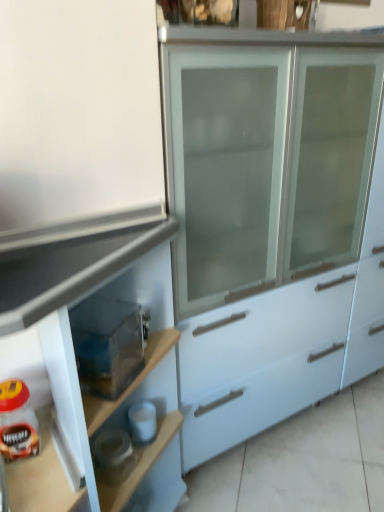
Question: Would you consider matte white cabinet at center to be distant from matte glass jar of coffee at lower left?

Choices:
 (A) yes
 (B) no

Answer: (B)

Question: Is matte white cabinet at center oriented away from matte glass jar of coffee at lower left?

Choices:
 (A) yes
 (B) no

Answer: (A)

Question: Can you confirm if matte white cabinet at center is bigger than matte glass jar of coffee at lower left?

Choices:
 (A) yes
 (B) no

Answer: (A)

Question: Is matte white cabinet at center closer to camera compared to matte glass jar of coffee at lower left?

Choices:
 (A) no
 (B) yes

Answer: (B)

Question: From the image's perspective, is matte white cabinet at center on matte glass jar of coffee at lower left?

Choices:
 (A) no
 (B) yes

Answer: (A)

Question: Considering the relative positions of matte white cabinet at center and transparent plastic container at lower left in the image provided, is matte white cabinet at center to the left or to the right of transparent plastic container at lower left?

Choices:
 (A) right
 (B) left

Answer: (B)

Question: From the image's perspective, is matte white cabinet at center above or below transparent plastic container at lower left?

Choices:
 (A) below
 (B) above

Answer: (A)

Question: Looking at their shapes, would you say matte white cabinet at center is wider or thinner than transparent plastic container at lower left?

Choices:
 (A) wide
 (B) thin

Answer: (A)

Question: In the image, is matte white cabinet at center positioned in front of or behind transparent plastic container at lower left?

Choices:
 (A) behind
 (B) front

Answer: (B)

Question: Relative to transparent plastic container at lower left, is matte glass jar of coffee at lower left in front or behind?

Choices:
 (A) front
 (B) behind

Answer: (B)

Question: From the image's perspective, is matte glass jar of coffee at lower left above or below transparent plastic container at lower left?

Choices:
 (A) above
 (B) below

Answer: (B)

Question: Is matte glass jar of coffee at lower left situated inside transparent plastic container at lower left or outside?

Choices:
 (A) outside
 (B) inside

Answer: (A)

Question: In terms of height, does matte glass jar of coffee at lower left look taller or shorter compared to transparent plastic container at lower left?

Choices:
 (A) tall
 (B) short

Answer: (B)

Question: From their relative heights in the image, would you say matte white cabinet at center is taller or shorter than matte glass jar of coffee at lower left?

Choices:
 (A) short
 (B) tall

Answer: (B)

Question: Is matte white cabinet at center bigger or smaller than matte glass jar of coffee at lower left?

Choices:
 (A) small
 (B) big

Answer: (B)